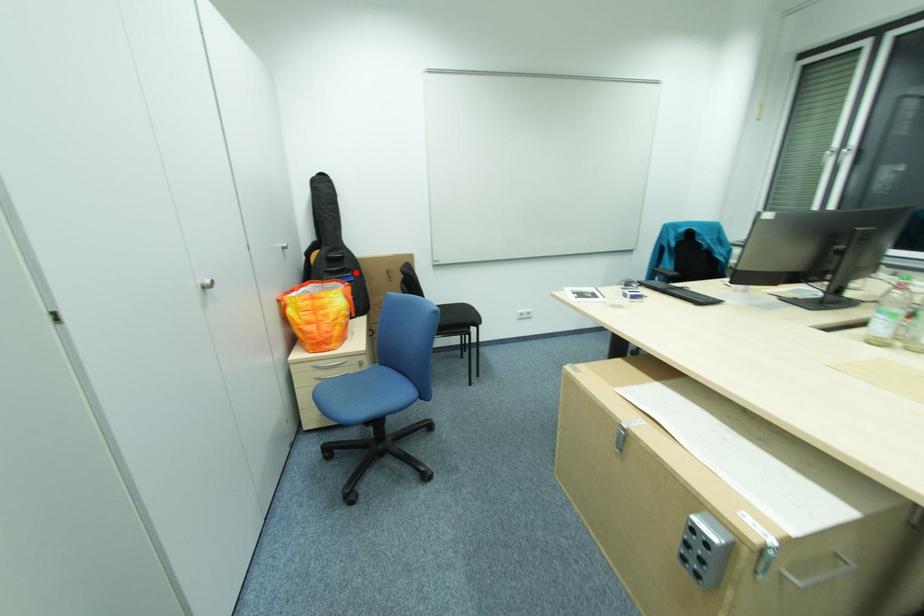
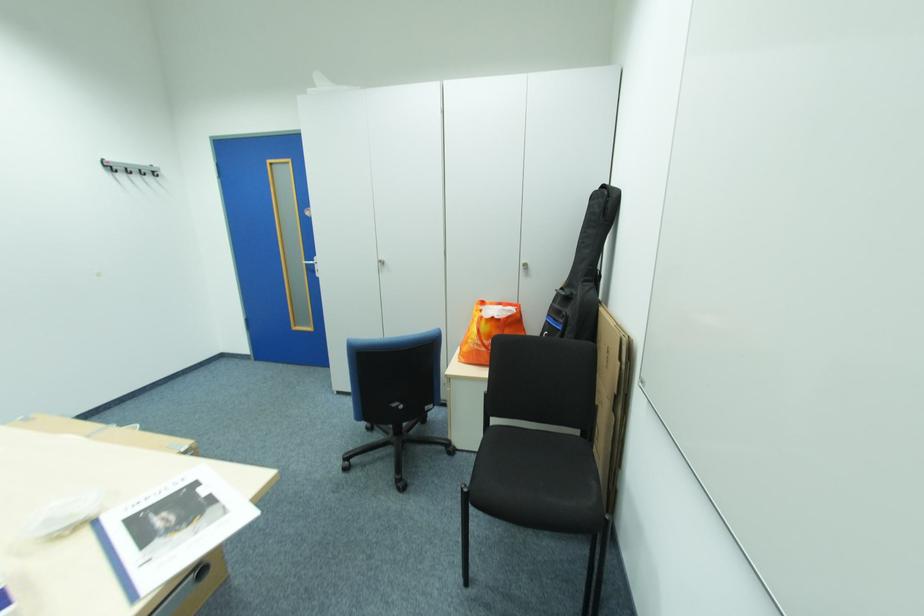
Question: I am providing you with two images of the same scene from different viewpoints. A red point is marked on the first image. At the location where the point appears in image 1, is it still visible in image 2?

Choices:
 (A) Yes
 (B) No

Answer: (A)